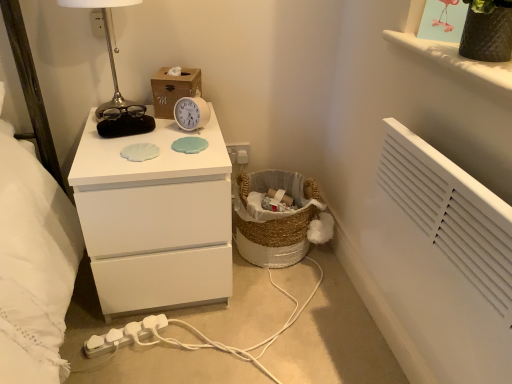
Locate an element on the screen. free location in front of white matte chest of drawers at center is located at coordinates (184, 352).